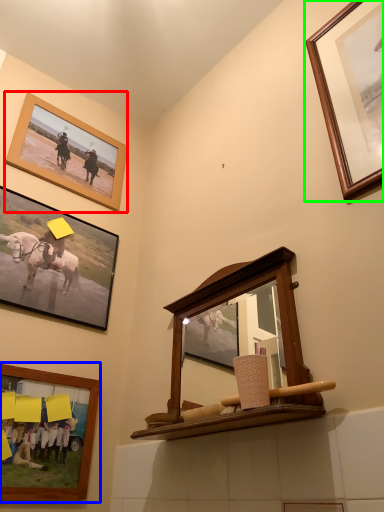
Question: Which object is the closest to the picture frame (highlighted by a red box)? Choose among these: picture frame (highlighted by a blue box) or picture frame (highlighted by a green box).

Choices:
 (A) picture frame
 (B) picture frame

Answer: (A)